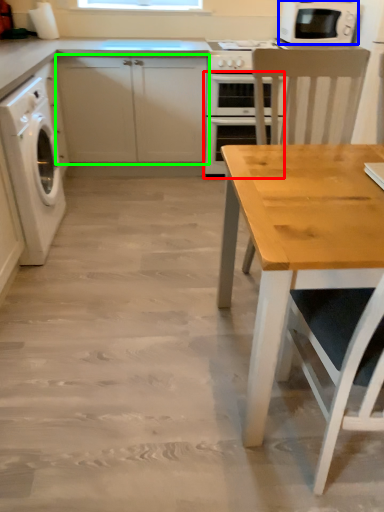
Question: Which object is positioned closest to oven (highlighted by a red box)? Select from microwave oven (highlighted by a blue box) and cabinetry (highlighted by a green box).

Choices:
 (A) microwave oven
 (B) cabinetry

Answer: (B)